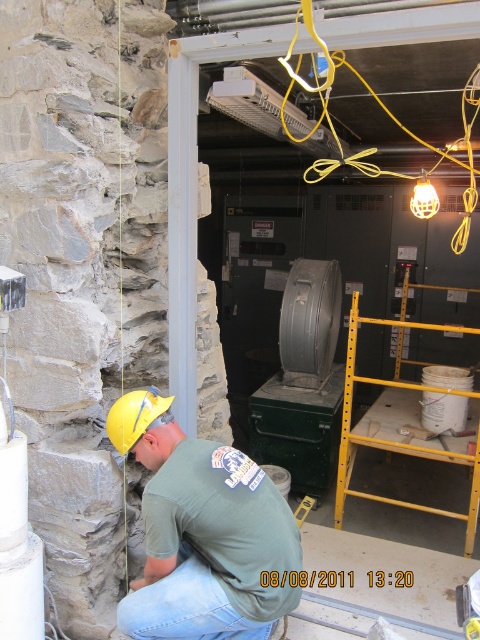
Looking at this image, you are a safety inspector checking the site. The green fabric shirt at lower center and the yellow metal ladder at right are in your view. Which object is wider?

The yellow metal ladder at right is wider than the green fabric shirt at lower center.

You are standing at the camera position and want to reach the point marked as point (236, 470). Can you estimate how far you need to walk to get there?

The distance of point (236, 470) from the camera is 6.08 feet, so you need to walk approximately 6.08 feet to reach it.